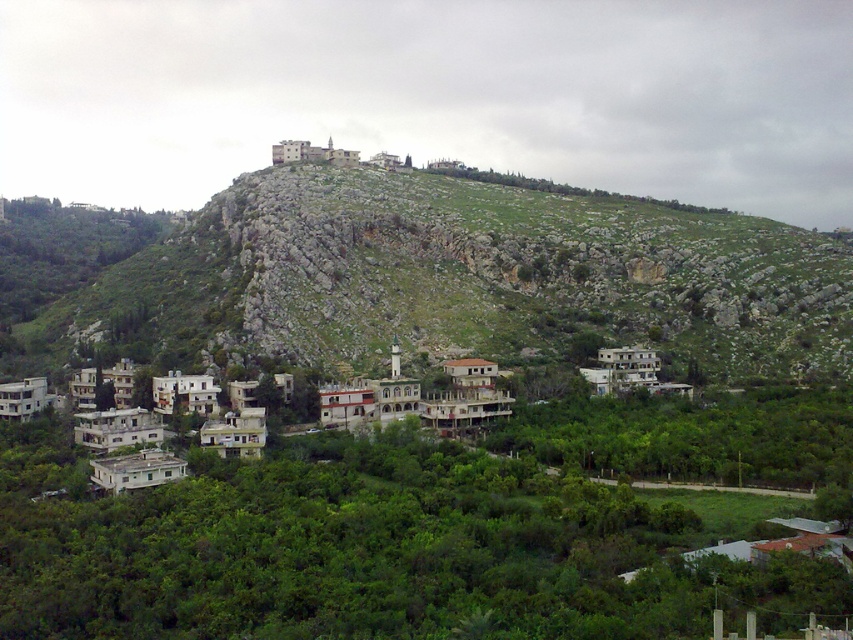
You are a photographer planning to capture the entire scene in one shot. Given that your camera can only focus on objects within a 100m width, will the green rocky mountain at upper center and the white concrete buildings at lower left fit within the frame?

The green rocky mountain at upper center has a larger width than the white concrete buildings at lower left. Since the camera can focus on objects within a 100m width, both objects can fit as long as their combined width does not exceed 100m. However, the description only provides a comparison of their widths, not exact measurements. Without knowing the exact width of the mountain or the buildings, it is impossible to determine if they will fit within the 100m limit.

You are a hiker planning to take a photo of the green rocky mountain at upper center and the white concrete buildings at lower left. Which object should you focus on if you want to capture both in a single frame without moving the camera?

You should focus on the white concrete buildings at lower left because it is closer to the camera than the green rocky mountain at upper center, allowing both to be in the same frame.

You are planning to hike to the green rocky mountain at upper center from the settlement. Based on the image, which direction should you head relative to the buildings in the midground?

The green rocky mountain at upper center is located at point coordinates, so you should head towards the upper center direction from the buildings in the midground.